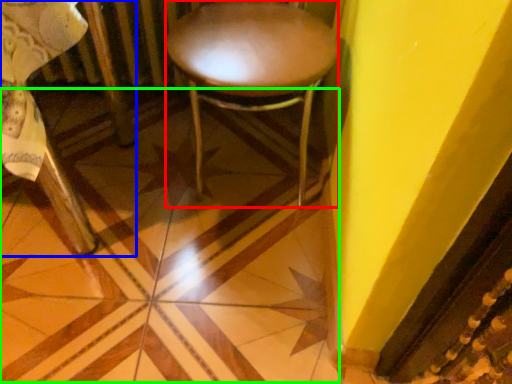
Question: Which object is positioned closest to stool (highlighted by a red box)? Select from chair (highlighted by a blue box) and tile (highlighted by a green box).

Choices:
 (A) chair
 (B) tile

Answer: (B)